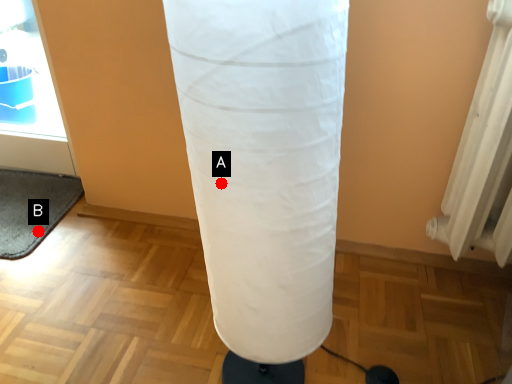
Question: Two points are circled on the image, labeled by A and B beside each circle. Which point is closer to the camera?

Choices:
 (A) A is closer
 (B) B is closer

Answer: (A)